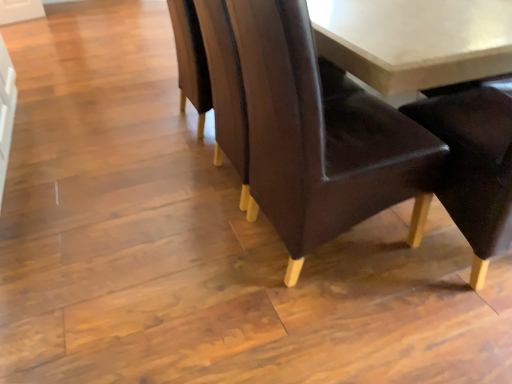
Question: From their relative heights in the image, would you say smooth brown table at upper right is taller or shorter than matte brown leather chair at center?

Choices:
 (A) short
 (B) tall

Answer: (A)

Question: In terms of size, does smooth brown table at upper right appear bigger or smaller than matte brown leather chair at center?

Choices:
 (A) big
 (B) small

Answer: (B)

Question: From the image's perspective, is smooth brown table at upper right above or below matte brown leather chair at center?

Choices:
 (A) above
 (B) below

Answer: (B)

Question: Considering the positions of matte brown leather chair at center and smooth brown table at upper right in the image, is matte brown leather chair at center wider or thinner than smooth brown table at upper right?

Choices:
 (A) thin
 (B) wide

Answer: (B)

Question: From a real-world perspective, is matte brown leather chair at center physically located above or below smooth brown table at upper right?

Choices:
 (A) below
 (B) above

Answer: (B)

Question: Which is correct: matte brown leather chair at center is inside smooth brown table at upper right, or outside of it?

Choices:
 (A) inside
 (B) outside

Answer: (B)

Question: Relative to smooth brown table at upper right, is matte brown leather chair at center in front or behind?

Choices:
 (A) behind
 (B) front

Answer: (B)